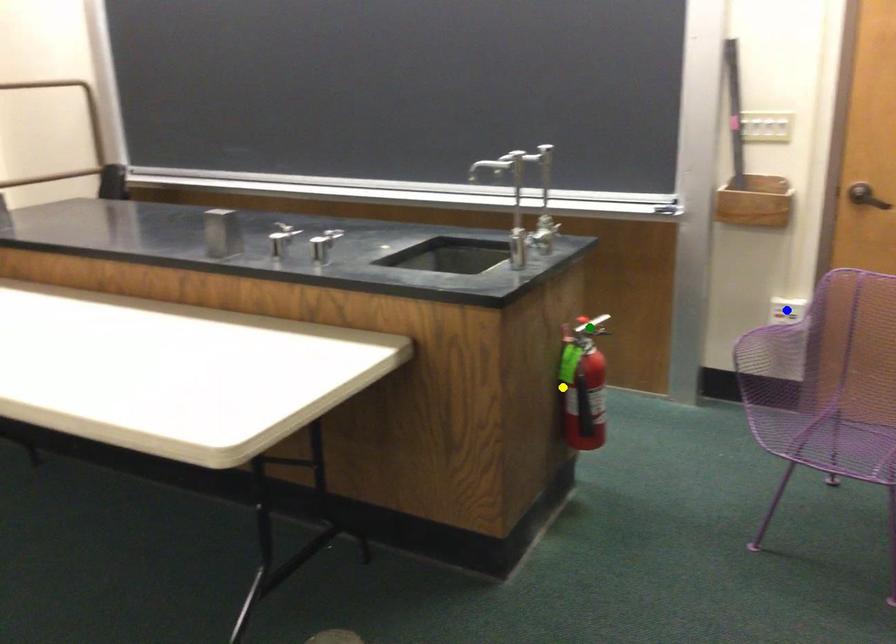
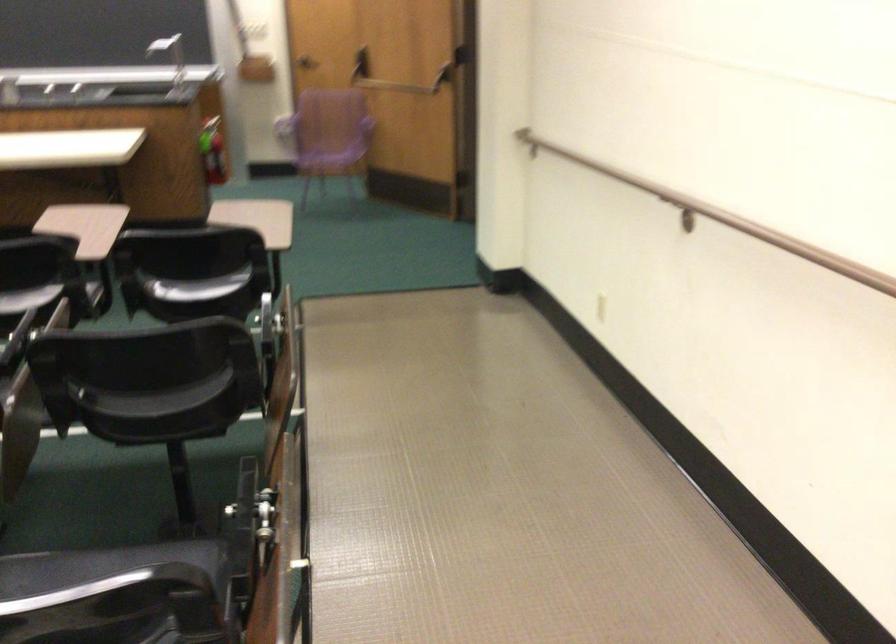
I am providing you with two images of the same scene from different viewpoints. Three points are marked in image1. Which point corresponds to a part or object that is occluded in image2?In image1, three points are marked. Which of them correspond to a part or object that is occluded in image2?Among the three points shown in image1, which one corresponds to a part or object that is no longer visible due to occlusion in image2?

blue point cannot be seen in image2.